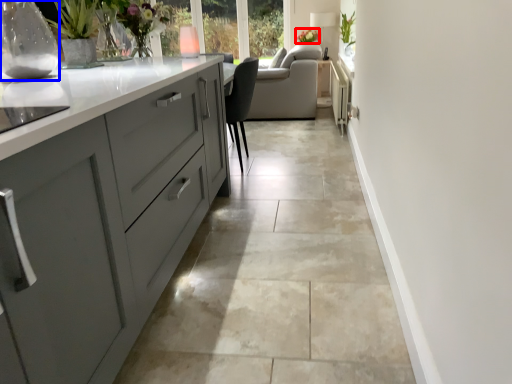
Question: Among these objects, which one is farthest to the camera, floral arrangement (highlighted by a red box) or glass vase (highlighted by a blue box)?

Choices:
 (A) floral arrangement
 (B) glass vase

Answer: (A)